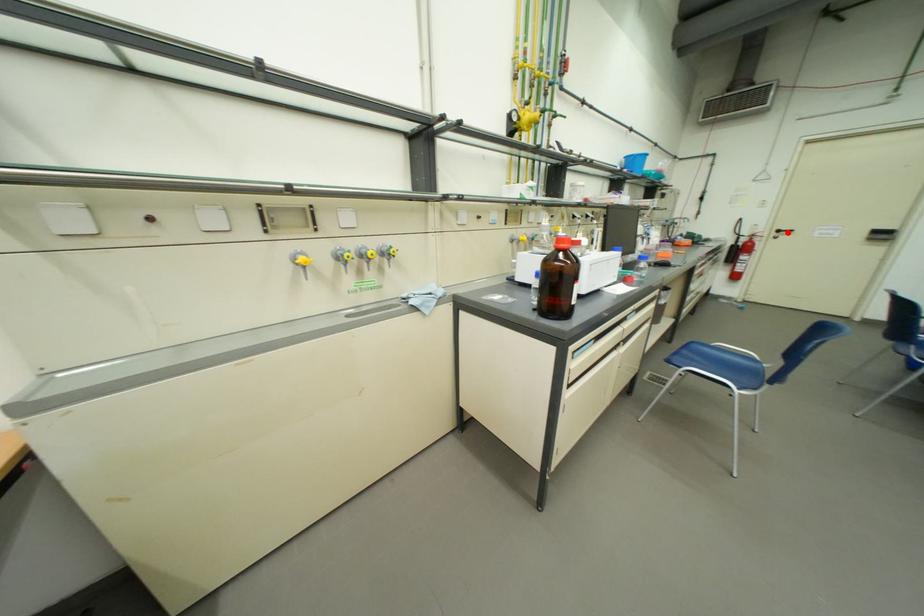
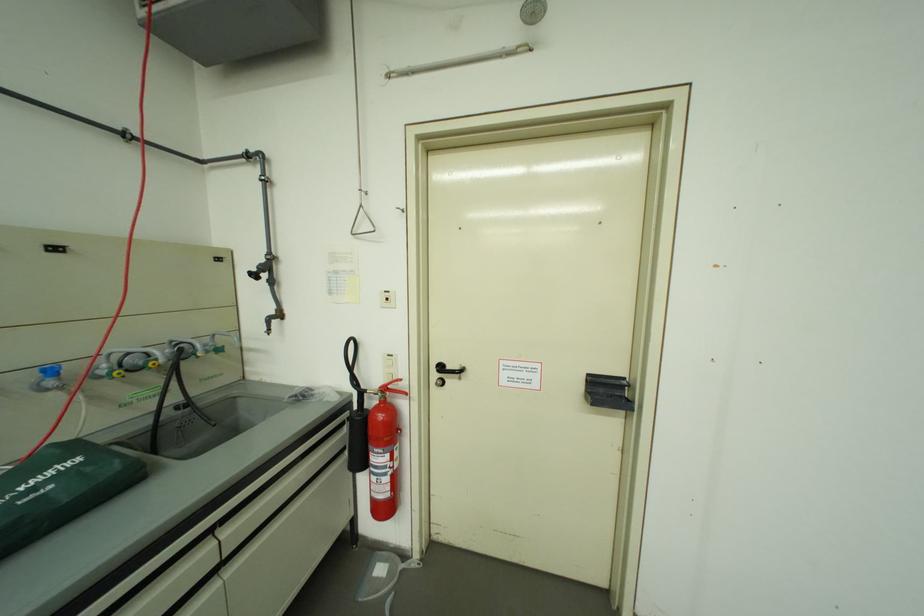
Locate, in the second image, the point that corresponds to the highlighted location in the first image.

(451, 369)